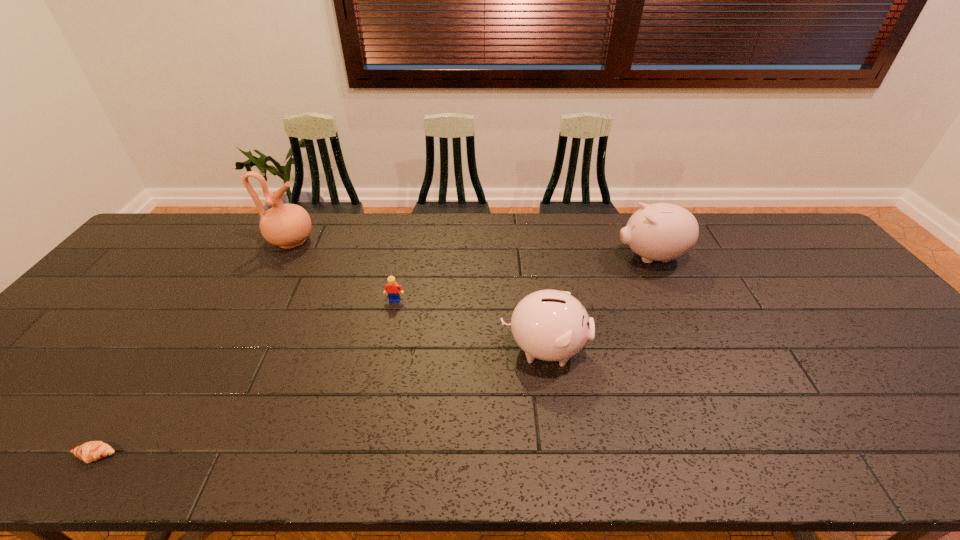
Where is `vacant space located 0.060m on the spout of the fourth object from right to left`? The height and width of the screenshot is (540, 960). vacant space located 0.060m on the spout of the fourth object from right to left is located at coordinates (333, 241).

This screenshot has width=960, height=540. I want to click on vacant space located at the snout of the rightmost object, so click(x=599, y=257).

You are a GUI agent. You are given a task and a screenshot of the screen. Output one action in this format:
    pyautogui.click(x=<x>, y=<y>)
    Task: Click on the free location located 0.350m at the snout of the rightmost object
    
    Given the screenshot: What is the action you would take?
    pyautogui.click(x=504, y=257)

Identify the location of free space located at the snout of the rightmost object. (536, 257).

At what (x,y) coordinates should I click in order to perform the action: click on vacant space located 0.350m on the right of the nearer piggy bank. Please return your answer as a coordinate pair (x, y). The width and height of the screenshot is (960, 540). Looking at the image, I should click on (727, 349).

This screenshot has width=960, height=540. What are the coordinates of `vacant region located on the face of the third nearest object` in the screenshot? It's located at (378, 380).

Where is `pottery situated at the far edge`? Image resolution: width=960 pixels, height=540 pixels. pottery situated at the far edge is located at coordinates (286, 225).

This screenshot has height=540, width=960. I want to click on piggy bank at the far edge, so point(662,232).

Image resolution: width=960 pixels, height=540 pixels. Identify the location of object at the near edge. (88, 452).

Identify the location of vacant region at the far edge of the desktop. The width and height of the screenshot is (960, 540). (585, 220).